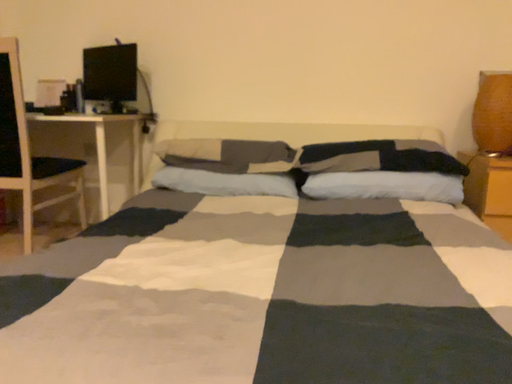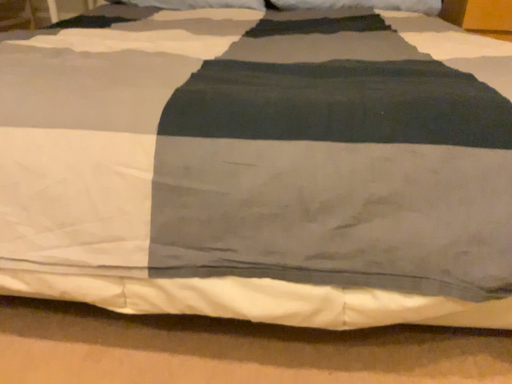
Question: Which way did the camera rotate in the video?

Choices:
 (A) rotated downward
 (B) rotated upward

Answer: (A)